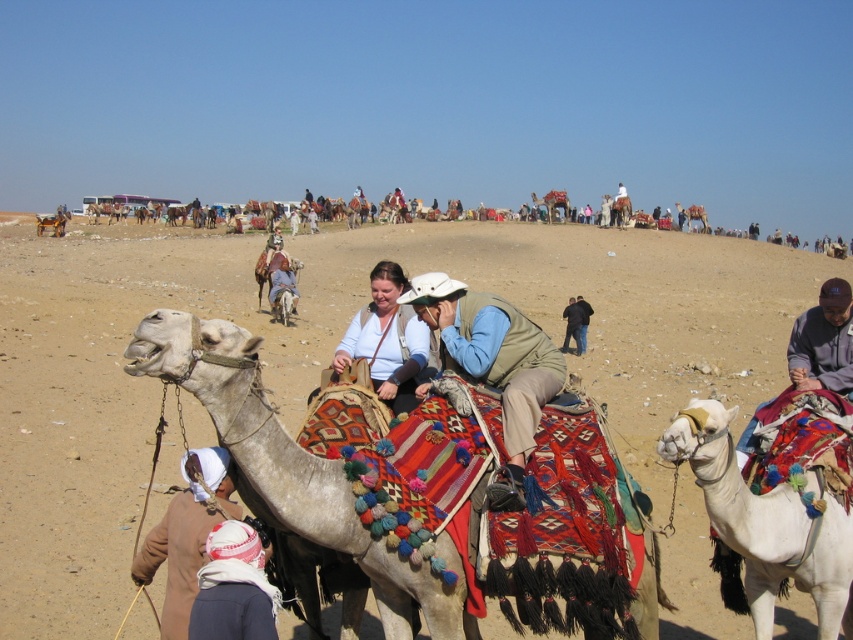
Question: Can you confirm if white textured camel at center is thinner than brown cotton headscarf at lower left?

Choices:
 (A) no
 (B) yes

Answer: (A)

Question: Based on their relative distances, which object is farther from the white soft camel at center?

Choices:
 (A) black fabric at center
 (B) white textured camel at center
 (C) white cotton headscarf at lower left
 (D) light brown fabric hat at center

Answer: (A)

Question: Which object is the closest to the light brown leather jacket at center?

Choices:
 (A) dark gray fabric at right
 (B) light blue denim shirt at center
 (C) brown cotton headscarf at lower left
 (D) black fabric at center

Answer: (C)

Question: Can you confirm if white textured camel at center is smaller than dark gray fabric at right?

Choices:
 (A) yes
 (B) no

Answer: (A)

Question: Which object is positioned closest to the dark gray fabric at right?

Choices:
 (A) light brown leather jacket at center
 (B) white cotton headscarf at lower left
 (C) light brown fabric hat at center

Answer: (C)

Question: In this image, where is white soft camel at center located relative to black fabric at center?

Choices:
 (A) right
 (B) left

Answer: (B)